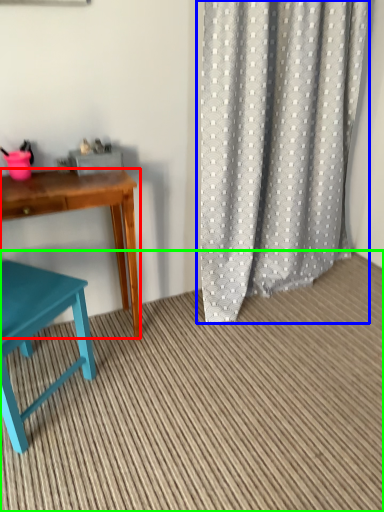
Question: Considering the real-world distances, which object is closest to desk (highlighted by a red box)? curtain (highlighted by a blue box) or plain (highlighted by a green box).

Choices:
 (A) curtain
 (B) plain

Answer: (B)